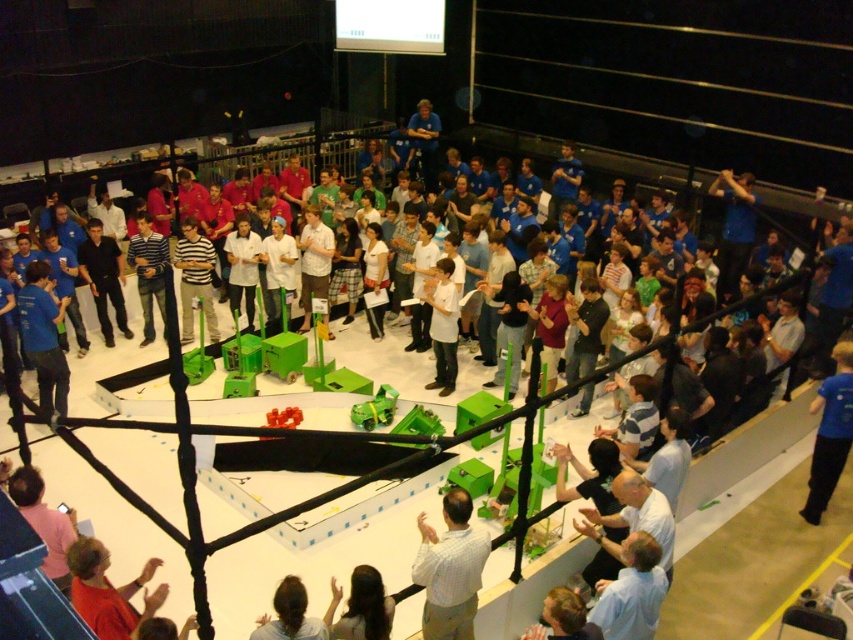
Question: Which point is closer to the camera?

Choices:
 (A) (656, 609)
 (B) (474, 536)
 (C) (724, 193)

Answer: (A)

Question: Does light blue shirt at center have a greater width compared to blue matte shirt at upper right?

Choices:
 (A) yes
 (B) no

Answer: (B)

Question: Estimate the real-world distances between objects in this image. Which object is farther from the light blue shirt at lower right?

Choices:
 (A) light blue shirt at center
 (B) blue shirt at center
 (C) light brown shirt at center

Answer: (B)

Question: Which object appears farthest from the camera in this image?

Choices:
 (A) dark blue shirt at center
 (B) blue shirt at center
 (C) blue shirt at upper center

Answer: (C)

Question: Can you confirm if light blue shirt at lower right is positioned to the right of blue shirt at center?

Choices:
 (A) no
 (B) yes

Answer: (A)

Question: Does light brown shirt at center have a larger size compared to dark blue shirt at center?

Choices:
 (A) yes
 (B) no

Answer: (B)